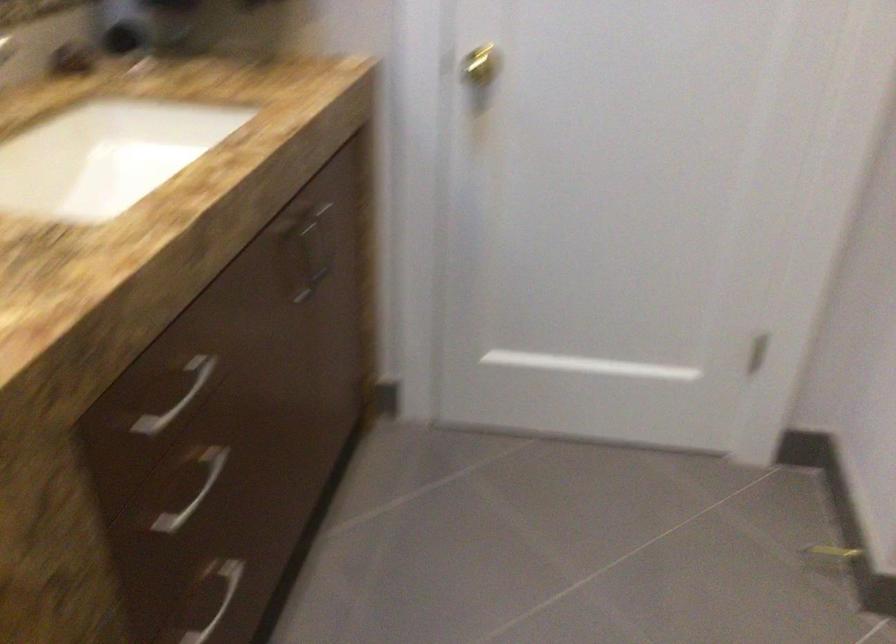
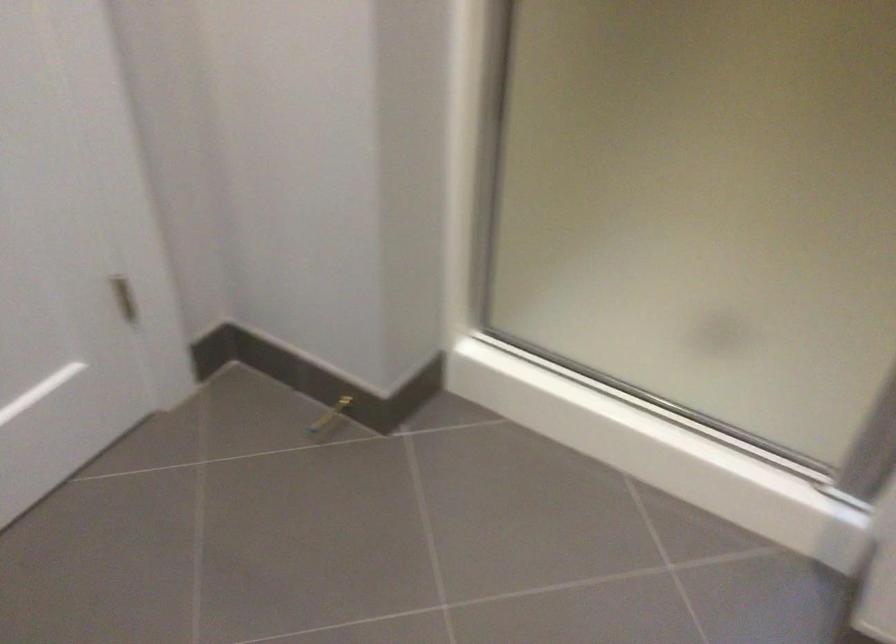
In the scene shown: First-person continuous shooting, in which direction is the camera rotating?

The rotation direction of the camera is right-down.